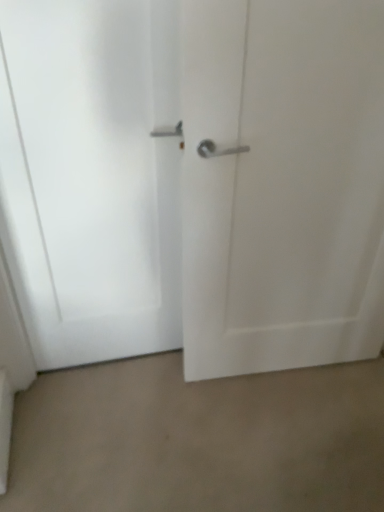
Find the location of a particular element. vacant area on top of beige carpet at lower center (from a real-world perspective) is located at coordinates [220, 432].